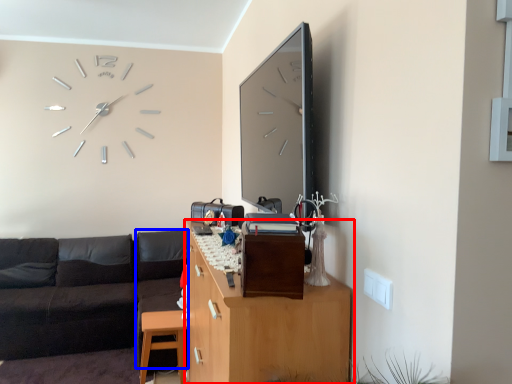
Question: Which object is closer to the camera taking this photo, cabinetry (highlighted by a red box) or couch (highlighted by a blue box)?

Choices:
 (A) cabinetry
 (B) couch

Answer: (A)